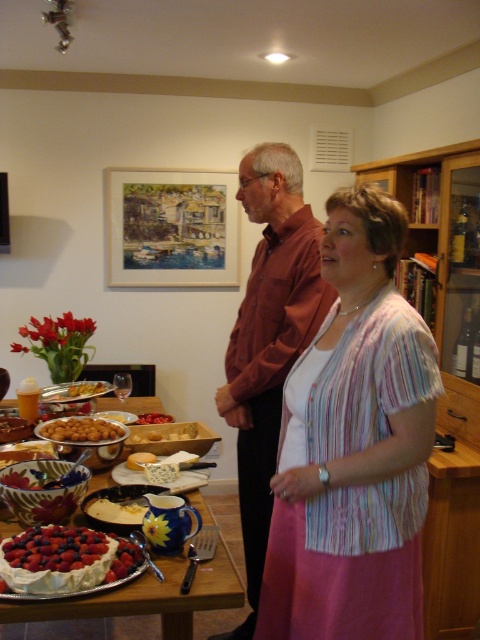
You are a guest at a dinner party and want to reach the ruffled white cake at lower left without disturbing the brown cotton shirt at center. Can you move around it?

The brown cotton shirt at center is further to the viewer than the ruffled white cake at lower left, so you can move around it to reach the cake without disturbing the shirt.

What are the coordinates of the ripe berries at center?

The ripe berries at center are located at coordinates point (55,548).

Based on the photo, you are a chef preparing to place a decorative plate between the brown cotton shirt at center and the yellow cheese at center. Which object should you move if the plate requires more space than the gap between them?

The brown cotton shirt at center is wider than the yellow cheese at center, so you should move the brown cotton shirt at center to accommodate the plate.